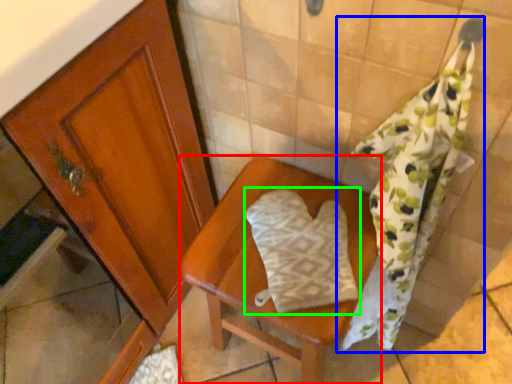
Question: Estimate the real-world distances between objects in this image. Which object is farther from furniture (highlighted by a red box), bath towel (highlighted by a blue box) or throw pillow (highlighted by a green box)?

Choices:
 (A) bath towel
 (B) throw pillow

Answer: (A)